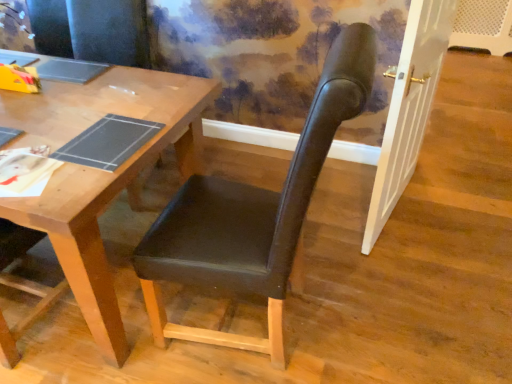
The width and height of the screenshot is (512, 384). Describe the element at coordinates (100, 173) in the screenshot. I see `wooden desk at center` at that location.

I want to click on wooden desk at center, so click(100, 173).

I want to click on black leather chair at center, so click(253, 213).

Image resolution: width=512 pixels, height=384 pixels. Describe the element at coordinates (253, 213) in the screenshot. I see `black leather chair at center` at that location.

You are a GUI agent. You are given a task and a screenshot of the screen. Output one action in this format:
    pyautogui.click(x=<x>, y=<y>)
    Task: Click on the wooden desk at center
    This screenshot has width=512, height=384.
    Given the screenshot: What is the action you would take?
    pyautogui.click(x=100, y=173)

Would you say wooden desk at center is to the left or to the right of black leather chair at center in the picture?

wooden desk at center is to the left of black leather chair at center.

Is wooden desk at center closer to the viewer compared to black leather chair at center?

No, wooden desk at center is further to the viewer.

Which point is more distant from viewer, (84,92) or (199,251)?

The point (84,92) is farther.

From the image's perspective, between wooden desk at center and black leather chair at center, which one is located above?

From the image's view, wooden desk at center is above.

From a real-world perspective, does wooden desk at center stand above black leather chair at center?

Actually, wooden desk at center is physically below black leather chair at center in the real world.

Is wooden desk at center wider or thinner than black leather chair at center?

In the image, wooden desk at center appears to be wider than black leather chair at center.

Is wooden desk at center shorter than black leather chair at center?

Correct, wooden desk at center is not as tall as black leather chair at center.

From the picture: Considering the relative sizes of wooden desk at center and black leather chair at center in the image provided, is wooden desk at center bigger than black leather chair at center?

Yes.

Would you say wooden desk at center contains black leather chair at center?

No, black leather chair at center is not a part of wooden desk at center.

Does wooden desk at center touch black leather chair at center?

There is a gap between wooden desk at center and black leather chair at center.

Looking at this image, is wooden desk at center facing away from black leather chair at center?

wooden desk at center does not have its back to black leather chair at center.

How different are the orientations of wooden desk at center and black leather chair at center in degrees?

The facing directions of wooden desk at center and black leather chair at center are 86.9 degrees apart.

How far apart are wooden desk at center and black leather chair at center?

They are 34.41 centimeters apart.

Where is `chair that is in front of the wooden desk at center`? chair that is in front of the wooden desk at center is located at coordinates (253, 213).

Is black leather chair at center at the left side of wooden desk at center?

Incorrect, black leather chair at center is not on the left side of wooden desk at center.

Between black leather chair at center and wooden desk at center, which one is positioned in front?

Positioned in front is black leather chair at center.

Considering the positions of point (198, 202) and point (168, 84), is point (198, 202) closer or farther from the camera than point (168, 84)?

Clearly, point (198, 202) is closer to the camera than point (168, 84).

From the image's perspective, is black leather chair at center located above wooden desk at center?

No, from the image's perspective, black leather chair at center is not on top of wooden desk at center.

From a real-world perspective, is black leather chair at center over wooden desk at center?

Yes, from a real-world perspective, black leather chair at center is on top of wooden desk at center.

Consider the image. Does black leather chair at center have a greater width compared to wooden desk at center?

Incorrect, the width of black leather chair at center does not surpass that of wooden desk at center.

Is black leather chair at center shorter than wooden desk at center?

No.

Can you confirm if black leather chair at center is bigger than wooden desk at center?

No.

Does black leather chair at center contain wooden desk at center?

No, black leather chair at center does not contain wooden desk at center.

Is black leather chair at center in contact with wooden desk at center?

There is a gap between black leather chair at center and wooden desk at center.

Is black leather chair at center turned away from wooden desk at center?

black leather chair at center does not have its back to wooden desk at center.

How different are the orientations of black leather chair at center and wooden desk at center in degrees?

The angle between the facing direction of black leather chair at center and the facing direction of wooden desk at center is 86.9 degrees.

The height and width of the screenshot is (384, 512). What are the coordinates of `chair that is on the right side of wooden desk at center` in the screenshot? It's located at (253, 213).

Locate an element on the screen. The image size is (512, 384). chair located in front of the wooden desk at center is located at coordinates (253, 213).

This screenshot has width=512, height=384. What are the coordinates of `desk above the black leather chair at center (from the image's perspective)` in the screenshot? It's located at (100, 173).